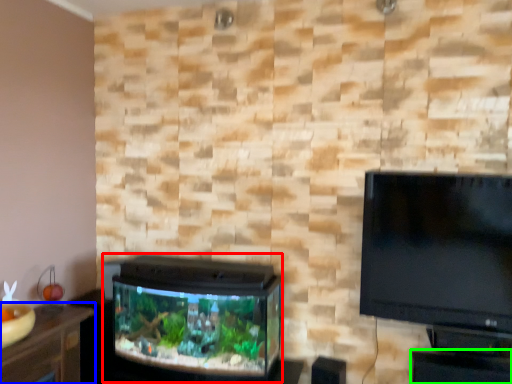
Question: Based on their relative distances, which object is farther from tv cabinet (highlighted by a red box)? Choose from furniture (highlighted by a blue box) and table (highlighted by a green box).

Choices:
 (A) furniture
 (B) table

Answer: (B)